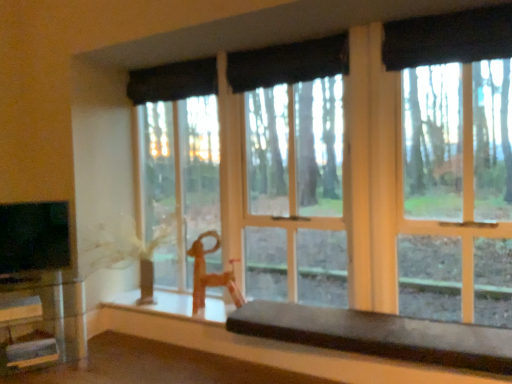
Question: In the image, is smooth dark brown bench at lower center, the 1th table viewed from the right, positioned in front of or behind black fabric curtain at upper center, which is the second curtain in back-to-front order?

Choices:
 (A) behind
 (B) front

Answer: (B)

Question: Considering the positions of smooth dark brown bench at lower center, arranged as the 2th table when viewed from the left, and black fabric curtain at upper center, the third curtain positioned from the front, in the image, is smooth dark brown bench at lower center, arranged as the 2th table when viewed from the left, wider or thinner than black fabric curtain at upper center, the third curtain positioned from the front,?

Choices:
 (A) thin
 (B) wide

Answer: (B)

Question: Which object is the farthest from the smooth dark brown bench at lower center, arranged as the 2th table when viewed from the left?

Choices:
 (A) clear glass table at lower left, the first table viewed from the left
 (B) black fabric curtain at upper center, which is the second curtain in back-to-front order
 (C) black fabric curtain at upper right, which ranks as the second curtain in front-to-back order
 (D) black fabric curtain at upper center, the fourth curtain positioned from the back
 (E) transparent glass window at center

Answer: (D)

Question: Which is nearer to the black fabric curtain at upper center, the 4th curtain from the front?

Choices:
 (A) black fabric curtain at upper right, placed as the 3th curtain when sorted from back to front
 (B) transparent glass window at center
 (C) black fabric curtain at upper center, the third curtain positioned from the front
 (D) black glossy tv at left
 (E) smooth dark brown bench at lower center, arranged as the 2th table when viewed from the left

Answer: (C)